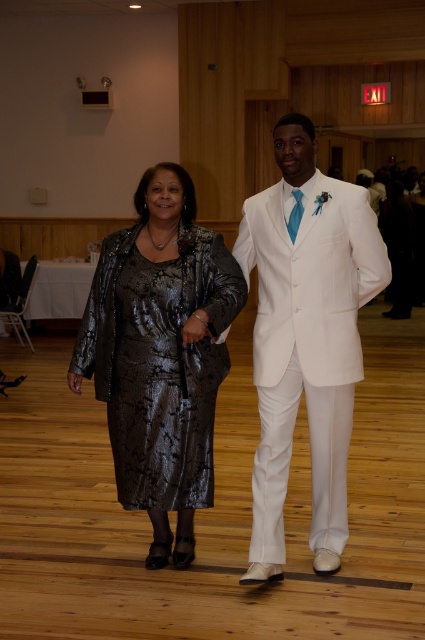
You are a photographer adjusting the lighting for a group photo. You notice the shiny metallic dress at center and the white satin suit at center. Which clothing item should you focus on first to ensure proper exposure, considering their positions?

The shiny metallic dress at center should be focused on first because the white satin suit at center is behind it, so adjusting the exposure for the dress will help ensure the suit is properly lit as well.

You are a photographer setting up for a formal event. You need to adjust the lighting so that both the shiny metallic dress at center and the white satin suit at center are evenly illuminated. Considering their heights, which one might require a higher light source to avoid shadows?

The shiny metallic dress at center is shorter than the white satin suit at center, so it might require a higher light source to ensure even illumination without casting shadows.

Based on the photo, you are a photographer trying to focus on the shiny metallic dress at center. What are the coordinates where you should aim your camera?

The shiny metallic dress at center is located at coordinates point (161,355), so aim your camera there.